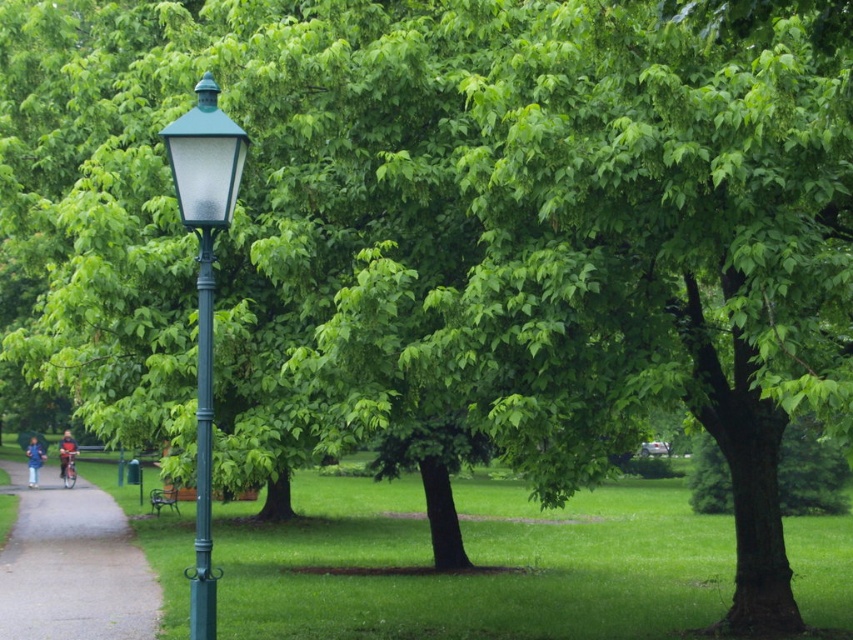
Question: Does blue denim jacket at lower left appear under blue fabric umbrella at lower left?

Choices:
 (A) no
 (B) yes

Answer: (A)

Question: Which object is closer to the camera taking this photo?

Choices:
 (A) gravel path at lower left
 (B) green metal bench at lower left
 (C) blue denim jacket at lower left
 (D) blue fabric umbrella at lower left

Answer: (A)

Question: Does blue denim jacket at lower left have a greater width compared to green metal bench at lower left?

Choices:
 (A) no
 (B) yes

Answer: (B)

Question: Which object appears farthest from the camera in this image?

Choices:
 (A) green matte pole at center-left
 (B) blue fabric umbrella at lower left
 (C) gravel path at lower left

Answer: (B)

Question: From the image, what is the correct spatial relationship of gravel path at lower left in relation to blue denim jacket at lower left?

Choices:
 (A) above
 (B) below

Answer: (B)

Question: Among these points, which one is farthest from the camera?

Choices:
 (A) (155, 486)
 (B) (73, 436)
 (C) (196, 541)
 (D) (120, 621)

Answer: (B)